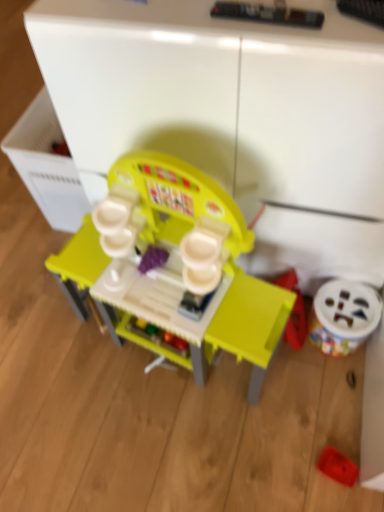
Question: From the image's perspective, does white plastic drawer at left appear lower than rubberized red tray at lower right, the second toy from the right?

Choices:
 (A) yes
 (B) no

Answer: (B)

Question: Is white plastic drawer at left turned away from rubberized red tray at lower right, which is the second toy in left-to-right order?

Choices:
 (A) no
 (B) yes

Answer: (A)

Question: Does white plastic drawer at left have a lesser width compared to rubberized red tray at lower right, which is the second toy in left-to-right order?

Choices:
 (A) yes
 (B) no

Answer: (B)

Question: From a real-world perspective, is white plastic drawer at left under rubberized red tray at lower right, which is the second toy in left-to-right order?

Choices:
 (A) no
 (B) yes

Answer: (A)

Question: From a real-world perspective, is white plastic drawer at left located higher than rubberized red tray at lower right, the second toy from the right?

Choices:
 (A) yes
 (B) no

Answer: (A)

Question: Considering the positions of matte plastic play kitchen at center, the first toy when ordered from left to right, and white plastic toy at lower right, the third toy when ordered from left to right, in the image, is matte plastic play kitchen at center, the first toy when ordered from left to right, taller or shorter than white plastic toy at lower right, the third toy when ordered from left to right,?

Choices:
 (A) short
 (B) tall

Answer: (B)

Question: Looking at the image, does matte plastic play kitchen at center, the first toy when ordered from left to right, seem bigger or smaller compared to white plastic toy at lower right, which appears as the first toy when viewed from the right?

Choices:
 (A) big
 (B) small

Answer: (A)

Question: Considering the positions of point (135, 159) and point (344, 286), is point (135, 159) closer or farther from the camera than point (344, 286)?

Choices:
 (A) closer
 (B) farther

Answer: (A)

Question: Relative to white plastic toy at lower right, which appears as the first toy when viewed from the right, is matte plastic play kitchen at center, the first toy when ordered from left to right, in front or behind?

Choices:
 (A) front
 (B) behind

Answer: (A)

Question: Is point (172, 211) positioned closer to the camera than point (354, 463)?

Choices:
 (A) farther
 (B) closer

Answer: (B)

Question: Looking at the image, does matte plastic play kitchen at center, the first toy when ordered from left to right, seem bigger or smaller compared to rubberized red tray at lower right, which is the second toy in left-to-right order?

Choices:
 (A) big
 (B) small

Answer: (A)

Question: In the image, is matte plastic play kitchen at center, positioned as the 3th toy in right-to-left order, on the left side or the right side of rubberized red tray at lower right, the second toy from the right?

Choices:
 (A) left
 (B) right

Answer: (A)

Question: From a real-world perspective, is matte plastic play kitchen at center, positioned as the 3th toy in right-to-left order, above or below rubberized red tray at lower right, the second toy from the right?

Choices:
 (A) above
 (B) below

Answer: (A)

Question: Is point (71, 169) closer or farther from the camera than point (173, 290)?

Choices:
 (A) closer
 (B) farther

Answer: (B)

Question: From the image's perspective, is white plastic drawer at left above or below matte plastic play kitchen at center, the first toy when ordered from left to right?

Choices:
 (A) above
 (B) below

Answer: (A)